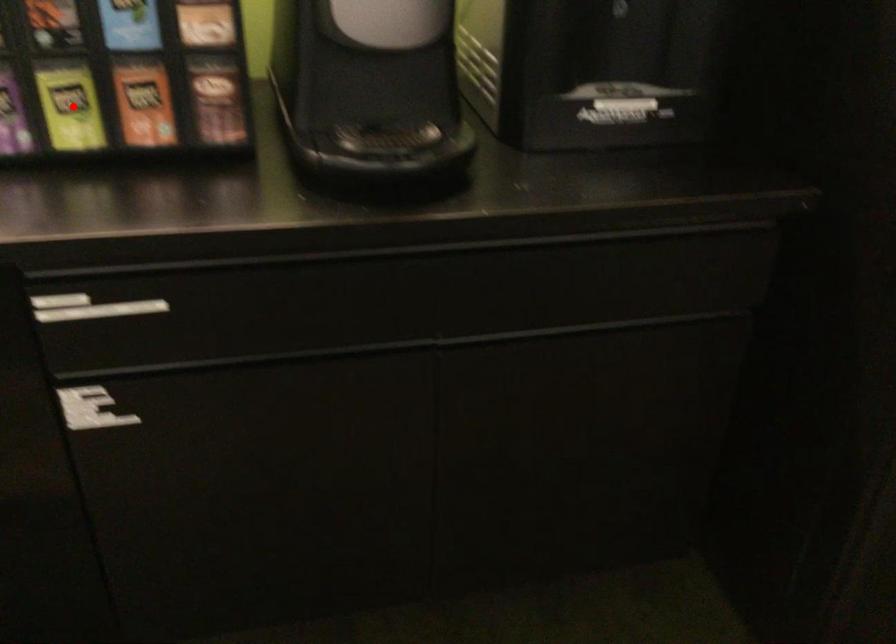
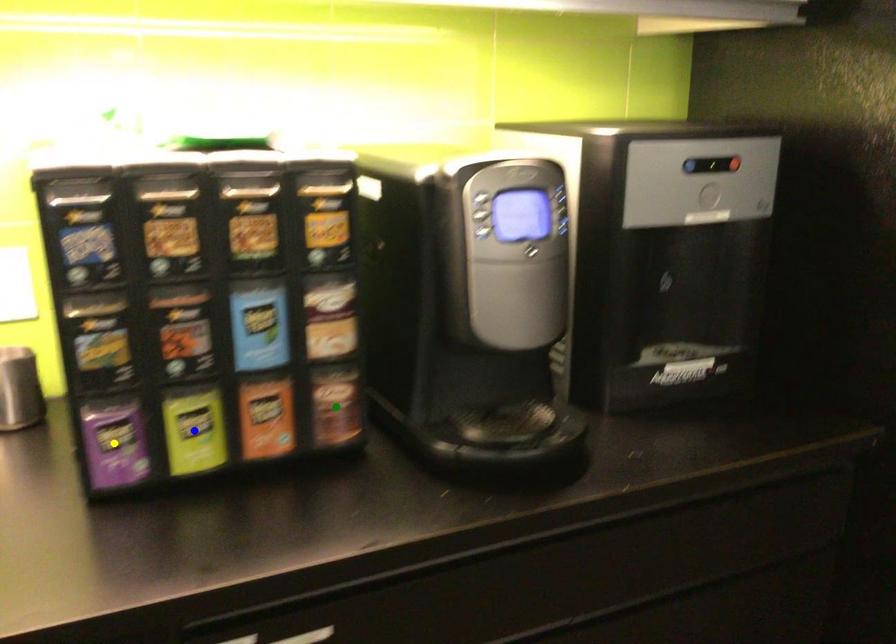
Question: I am providing you with two images of the same scene from different viewpoints. A red point is marked on the first image. You are given multiple points on the second image. Which point in image 2 represents the same 3d spot as the red point in image 1?

Choices:
 (A) yellow point
 (B) blue point
 (C) green point

Answer: (B)